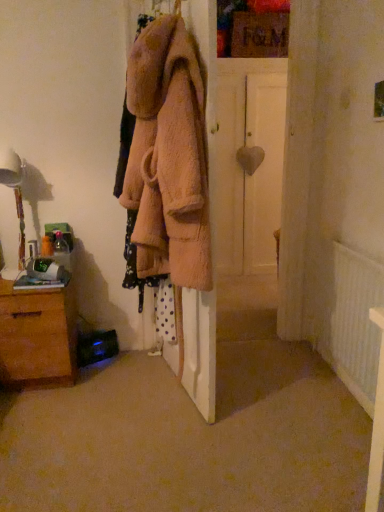
The height and width of the screenshot is (512, 384). I want to click on vacant space behind white textured radiator at lower right, so click(x=297, y=359).